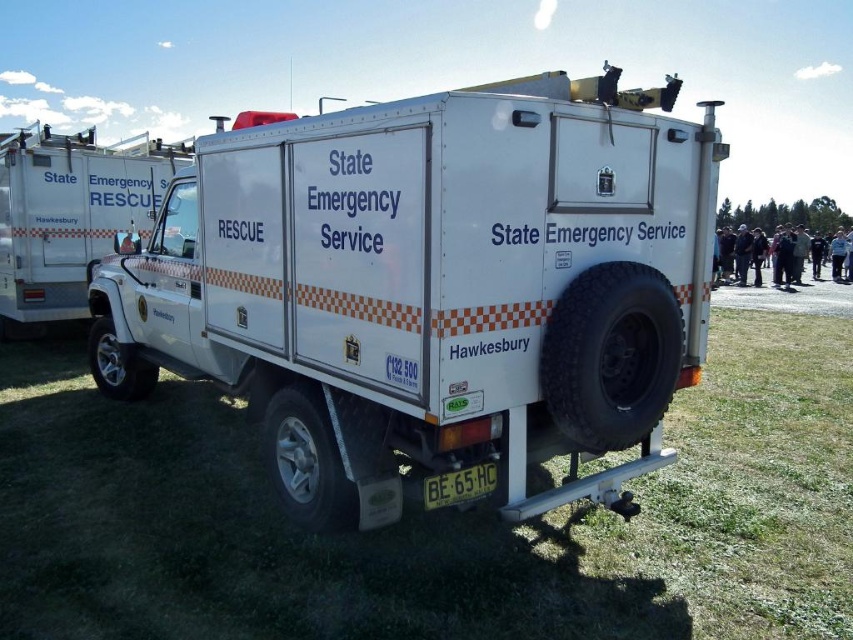
From the picture: Between white matte rescue vehicle at center and green grass at lower center, which one is positioned lower?

green grass at lower center

Where is `white matte rescue vehicle at center`? white matte rescue vehicle at center is located at coordinates (432, 288).

Describe the element at coordinates (432, 288) in the screenshot. I see `white matte rescue vehicle at center` at that location.

Is point (622, 380) positioned before point (445, 499)?

No, it is behind (445, 499).

Which is in front, point (326, 154) or point (440, 477)?

Point (440, 477) is in front.

Find the location of a particular element. This screenshot has width=853, height=640. white matte rescue vehicle at center is located at coordinates (432, 288).

Is the position of green grass at lower center more distant than that of yellow metallic license plate at lower center?

No, green grass at lower center is in front of yellow metallic license plate at lower center.

Can you confirm if green grass at lower center is positioned above yellow metallic license plate at lower center?

Incorrect, green grass at lower center is not positioned above yellow metallic license plate at lower center.

Who is more distant from viewer, (677, 637) or (469, 483)?

The point (469, 483) is more distant.

Find the location of `green grass at lower center`. green grass at lower center is located at coordinates (430, 518).